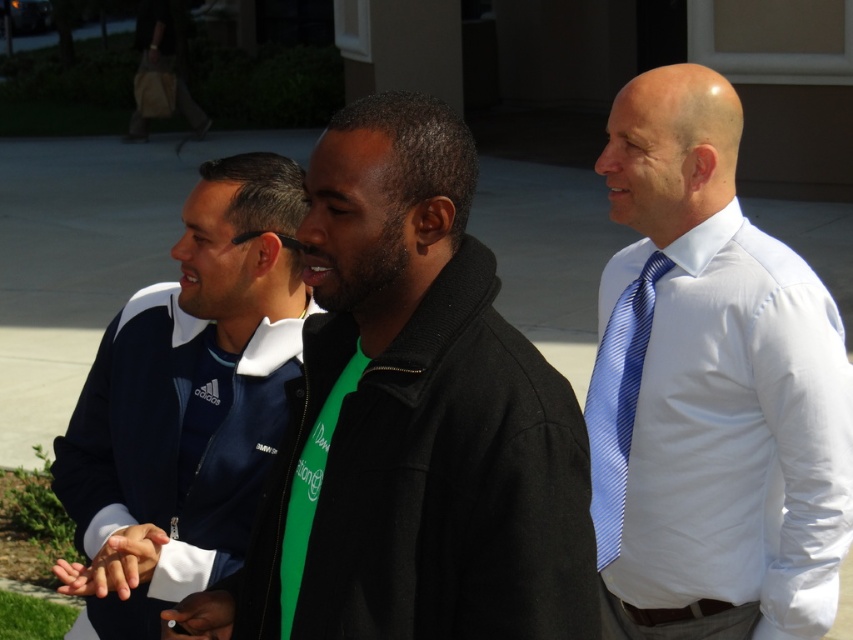
Is dark blue adidas jacket at center closer to camera compared to blue striped tie at right?

Yes, dark blue adidas jacket at center is closer to the viewer.

Is point (103, 397) farther from camera compared to point (670, 262)?

No, it is not.

The width and height of the screenshot is (853, 640). I want to click on dark blue adidas jacket at center, so click(187, 403).

Who is lower down, black matte jacket at center or blue striped tie at right?

blue striped tie at right

Is black matte jacket at center further to the viewer compared to blue striped tie at right?

No, black matte jacket at center is in front of blue striped tie at right.

Is point (335, 292) closer to camera compared to point (606, 547)?

Yes, point (335, 292) is in front of point (606, 547).

Locate an element on the screen. The height and width of the screenshot is (640, 853). black matte jacket at center is located at coordinates (412, 420).

Is point (575, 477) closer to viewer compared to point (248, 458)?

Yes, it is.

Who is positioned more to the left, black matte jacket at center or dark blue adidas jacket at center?

Positioned to the left is dark blue adidas jacket at center.

Image resolution: width=853 pixels, height=640 pixels. I want to click on black matte jacket at center, so click(x=412, y=420).

This screenshot has height=640, width=853. I want to click on black matte jacket at center, so click(412, 420).